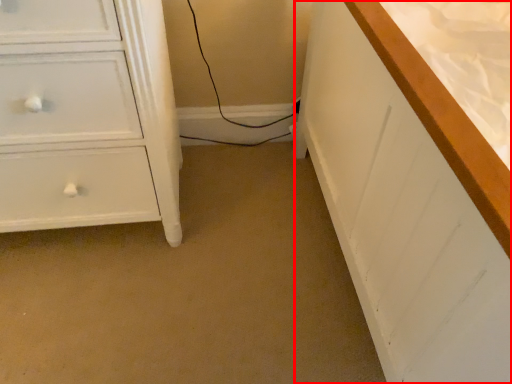
Question: From the image's perspective, where is counter top (annotated by the red box) located in relation to chest of drawers in the image?

Choices:
 (A) below
 (B) above

Answer: (A)